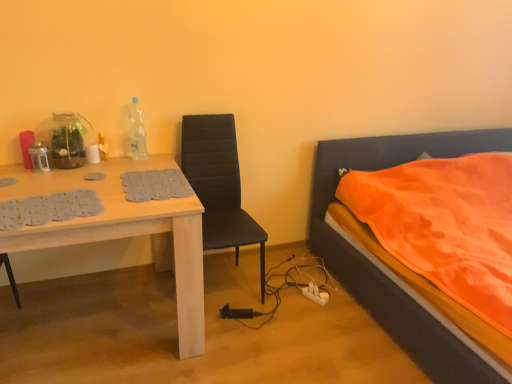
Locate an element on the screen. Image resolution: width=512 pixels, height=384 pixels. free space between light wood table at left and black leather chair at center is located at coordinates (228, 330).